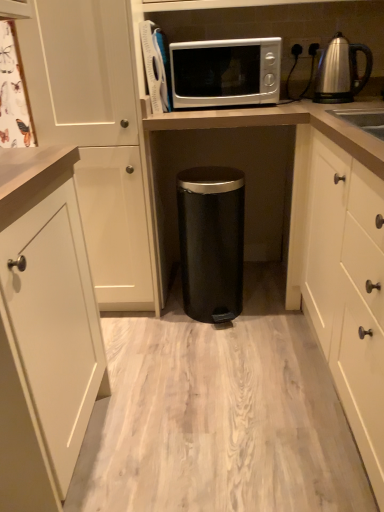
How much space does white matte cabinet at left, the first cabinetry in the left-to-right sequence, occupy horizontally?

The width of white matte cabinet at left, the first cabinetry in the left-to-right sequence, is 60.18 centimeters.

What do you see at coordinates (340, 71) in the screenshot? This screenshot has width=384, height=512. I see `satin silver kettle at upper right` at bounding box center [340, 71].

Measure the distance between point (241, 297) and camera.

The depth of point (241, 297) is 2.09 meters.

You are a GUI agent. You are given a task and a screenshot of the screen. Output one action in this format:
    pyautogui.click(x=<x>, y=<y>)
    Task: Click on the black matte trash can at center, which is counted as the second appliance, starting from the top
    The height and width of the screenshot is (512, 384).
    Given the screenshot: What is the action you would take?
    pyautogui.click(x=211, y=241)

What do you see at coordinates (225, 72) in the screenshot? The image size is (384, 512). I see `satin silver microwave at upper center` at bounding box center [225, 72].

At what (x,y) coordinates should I click in order to perform the action: click on white matte cabinet at left, marked as the 2th cabinetry in a right-to-left arrangement. Please return your answer as a coordinate pair (x, y). Image resolution: width=384 pixels, height=512 pixels. Looking at the image, I should click on (95, 134).

From a real-world perspective, is satin silver kettle at upper right located higher than satin silver microwave at upper center, the first appliance from the top?

No, from a real-world perspective, satin silver kettle at upper right is not over satin silver microwave at upper center, the first appliance from the top

Can you confirm if satin silver kettle at upper right is smaller than satin silver microwave at upper center, the first appliance from the top?

Yes, satin silver kettle at upper right is smaller than satin silver microwave at upper center, the first appliance from the top.

Would you say satin silver kettle at upper right contains satin silver microwave at upper center, the first appliance from the top?

No, satin silver kettle at upper right does not contain satin silver microwave at upper center, the first appliance from the top.

Does point (327, 78) come behind point (143, 47)?

Yes, point (327, 78) is behind point (143, 47).

Based on the photo, from the image's perspective, is satin silver microwave at upper center, the 2th appliance from the right, positioned above or below white matte cabinet at right, acting as the 2th cabinetry starting from the left?

From the image's perspective, satin silver microwave at upper center, the 2th appliance from the right, appears above white matte cabinet at right, acting as the 2th cabinetry starting from the left.

How much distance is there between satin silver microwave at upper center, the second appliance positioned from the bottom, and white matte cabinet at right, which appears as the first cabinetry when viewed from the right?

satin silver microwave at upper center, the second appliance positioned from the bottom, and white matte cabinet at right, which appears as the first cabinetry when viewed from the right, are 33.64 inches apart from each other.

Can you tell me how much satin silver microwave at upper center, the 2th appliance from the right, and white matte cabinet at right, acting as the 2th cabinetry starting from the left, differ in facing direction?

There is a 92.8-degree angle between the facing directions of satin silver microwave at upper center, the 2th appliance from the right, and white matte cabinet at right, acting as the 2th cabinetry starting from the left.

Between satin silver microwave at upper center, the 2th appliance from the right, and white matte cabinet at right, acting as the 2th cabinetry starting from the left, which one is positioned in front?

white matte cabinet at right, acting as the 2th cabinetry starting from the left, is in front.

Is satin silver kettle at upper right at the right side of black matte trash can at center, which is the 1th appliance in bottom-to-top order?

Indeed, satin silver kettle at upper right is positioned on the right side of black matte trash can at center, which is the 1th appliance in bottom-to-top order.

Which object is further away from the camera, satin silver kettle at upper right or black matte trash can at center, which is counted as the second appliance, starting from the top?

Positioned behind is satin silver kettle at upper right.

Considering the sizes of objects satin silver kettle at upper right and black matte trash can at center, placed as the first appliance when sorted from right to left, in the image provided, who is shorter, satin silver kettle at upper right or black matte trash can at center, placed as the first appliance when sorted from right to left,?

Standing shorter between the two is satin silver kettle at upper right.

The image size is (384, 512). Find the location of `kettle that is above the black matte trash can at center, acting as the second appliance starting from the left (from a real-world perspective)`. kettle that is above the black matte trash can at center, acting as the second appliance starting from the left (from a real-world perspective) is located at coordinates (340, 71).

From the picture: Is white matte cabinet at left, marked as the 2th cabinetry in a right-to-left arrangement, taller than satin silver microwave at upper center, the second appliance positioned from the bottom?

Yes, white matte cabinet at left, marked as the 2th cabinetry in a right-to-left arrangement, is taller than satin silver microwave at upper center, the second appliance positioned from the bottom.

From a real-world perspective, starting from the satin silver microwave at upper center, the first appliance from the top, which cabinetry is the 1st one below it? Please provide its 2D coordinates.

[(95, 134)]

From the image's perspective, which one is positioned lower, white matte cabinet at left, the first cabinetry in the left-to-right sequence, or satin silver microwave at upper center, the second appliance positioned from the bottom?

white matte cabinet at left, the first cabinetry in the left-to-right sequence, appears lower in the image.

Is white matte cabinet at left, marked as the 2th cabinetry in a right-to-left arrangement, facing towards satin silver microwave at upper center, the 1th appliance from the left?

No.

Starting from the white matte cabinet at left, marked as the 2th cabinetry in a right-to-left arrangement, which appliance is the 2nd one behind? Please provide its 2D coordinates.

[(211, 241)]

Would you say black matte trash can at center, which is the 1th appliance in bottom-to-top order, is outside white matte cabinet at left, the first cabinetry in the left-to-right sequence?

Yes, black matte trash can at center, which is the 1th appliance in bottom-to-top order, is outside of white matte cabinet at left, the first cabinetry in the left-to-right sequence.

Is the surface of black matte trash can at center, which is counted as the second appliance, starting from the top, in direct contact with white matte cabinet at left, marked as the 2th cabinetry in a right-to-left arrangement?

There is a gap between black matte trash can at center, which is counted as the second appliance, starting from the top, and white matte cabinet at left, marked as the 2th cabinetry in a right-to-left arrangement.

Is white matte cabinet at right, which appears as the first cabinetry when viewed from the right, closer to camera compared to white matte cabinet at left, the first cabinetry in the left-to-right sequence?

Yes, white matte cabinet at right, which appears as the first cabinetry when viewed from the right, is closer to the camera.

Based on the photo, is white matte cabinet at right, which appears as the first cabinetry when viewed from the right, to the left or to the right of white matte cabinet at left, marked as the 2th cabinetry in a right-to-left arrangement, in the image?

white matte cabinet at right, which appears as the first cabinetry when viewed from the right, is positioned on white matte cabinet at left, marked as the 2th cabinetry in a right-to-left arrangement,'s right side.

From a real-world perspective, is white matte cabinet at right, which appears as the first cabinetry when viewed from the right, above or below white matte cabinet at left, marked as the 2th cabinetry in a right-to-left arrangement?

In terms of real-world spatial position, white matte cabinet at right, which appears as the first cabinetry when viewed from the right, is below white matte cabinet at left, marked as the 2th cabinetry in a right-to-left arrangement.

Is satin silver microwave at upper center, the 1th appliance from the left, at the back of white matte cabinet at right, which appears as the first cabinetry when viewed from the right?

white matte cabinet at right, which appears as the first cabinetry when viewed from the right, does not have its back to satin silver microwave at upper center, the 1th appliance from the left.

Consider the image. From a real-world perspective, is white matte cabinet at right, acting as the 2th cabinetry starting from the left, positioned under satin silver microwave at upper center, the first appliance from the top, based on gravity?

Indeed, from a real-world perspective, white matte cabinet at right, acting as the 2th cabinetry starting from the left, is positioned beneath satin silver microwave at upper center, the first appliance from the top.

From the image's perspective, is white matte cabinet at right, acting as the 2th cabinetry starting from the left, above or below satin silver microwave at upper center, the 2th appliance from the right?

white matte cabinet at right, acting as the 2th cabinetry starting from the left, is situated lower than satin silver microwave at upper center, the 2th appliance from the right, in the image.

Does white matte cabinet at right, acting as the 2th cabinetry starting from the left, have a greater width compared to satin silver microwave at upper center, the first appliance from the top?

Yes, white matte cabinet at right, acting as the 2th cabinetry starting from the left, is wider than satin silver microwave at upper center, the first appliance from the top.

Image resolution: width=384 pixels, height=512 pixels. Identify the location of the 2nd appliance in front of the satin silver kettle at upper right, starting your count from the anchor. (155, 67).

I want to click on the 2nd appliance to the left when counting from the white matte cabinet at right, which appears as the first cabinetry when viewed from the right, so click(155, 67).

From the picture: Estimate the real-world distances between objects in this image. Which object is closer to satin silver microwave at upper center, white matte cabinet at left, the first cabinetry in the left-to-right sequence, or satin silver microwave at upper center, the 1th appliance from the left?

satin silver microwave at upper center, the 1th appliance from the left, lies closer to satin silver microwave at upper center than the other object.

Estimate the real-world distances between objects in this image. Which object is closer to satin silver kettle at upper right, white matte cabinet at left, marked as the 2th cabinetry in a right-to-left arrangement, or white matte cabinet at right, which appears as the first cabinetry when viewed from the right?

white matte cabinet at right, which appears as the first cabinetry when viewed from the right.

Considering their positions, is satin silver microwave at upper center, the 2th appliance from the right, positioned closer to white matte cabinet at left, the first cabinetry in the left-to-right sequence, than white matte cabinet at right, acting as the 2th cabinetry starting from the left?

satin silver microwave at upper center, the 2th appliance from the right.

From the image, which object appears to be farther from white matte cabinet at left, marked as the 2th cabinetry in a right-to-left arrangement, satin silver microwave at upper center or black matte trash can at center, which is counted as the second appliance, starting from the top?

Among the two, satin silver microwave at upper center is located further to white matte cabinet at left, marked as the 2th cabinetry in a right-to-left arrangement.

When comparing their distances from black matte trash can at center, placed as the first appliance when sorted from right to left, does satin silver microwave at upper center or satin silver kettle at upper right seem closer?

satin silver microwave at upper center is closer to black matte trash can at center, placed as the first appliance when sorted from right to left.

Considering their positions, is white matte cabinet at left, marked as the 2th cabinetry in a right-to-left arrangement, positioned further to white matte cabinet at right, which appears as the first cabinetry when viewed from the right, than satin silver kettle at upper right?

white matte cabinet at left, marked as the 2th cabinetry in a right-to-left arrangement, is positioned further to the anchor white matte cabinet at right, which appears as the first cabinetry when viewed from the right.

From the picture: Estimate the real-world distances between objects in this image. Which object is closer to white matte cabinet at left, marked as the 2th cabinetry in a right-to-left arrangement, white matte cabinet at right, acting as the 2th cabinetry starting from the left, or satin silver microwave at upper center, the second appliance positioned from the bottom?

The object closer to white matte cabinet at left, marked as the 2th cabinetry in a right-to-left arrangement, is satin silver microwave at upper center, the second appliance positioned from the bottom.

From the image, which object appears to be farther from satin silver kettle at upper right, satin silver microwave at upper center or satin silver microwave at upper center, the second appliance positioned from the bottom?

satin silver microwave at upper center, the second appliance positioned from the bottom, is further to satin silver kettle at upper right.

This screenshot has height=512, width=384. I want to click on kettle that lies between satin silver microwave at upper center and black matte trash can at center, acting as the second appliance starting from the left, from top to bottom, so click(x=340, y=71).

Image resolution: width=384 pixels, height=512 pixels. I want to click on microwave oven between satin silver microwave at upper center, the 2th appliance from the right, and satin silver kettle at upper right from left to right, so click(x=225, y=72).

This screenshot has height=512, width=384. Identify the location of kettle between satin silver microwave at upper center, the 2th appliance from the right, and black matte trash can at center, acting as the second appliance starting from the left, vertically. (340, 71).

Identify the location of microwave oven between white matte cabinet at left, the first cabinetry in the left-to-right sequence, and satin silver kettle at upper right, in the horizontal direction. (225, 72).